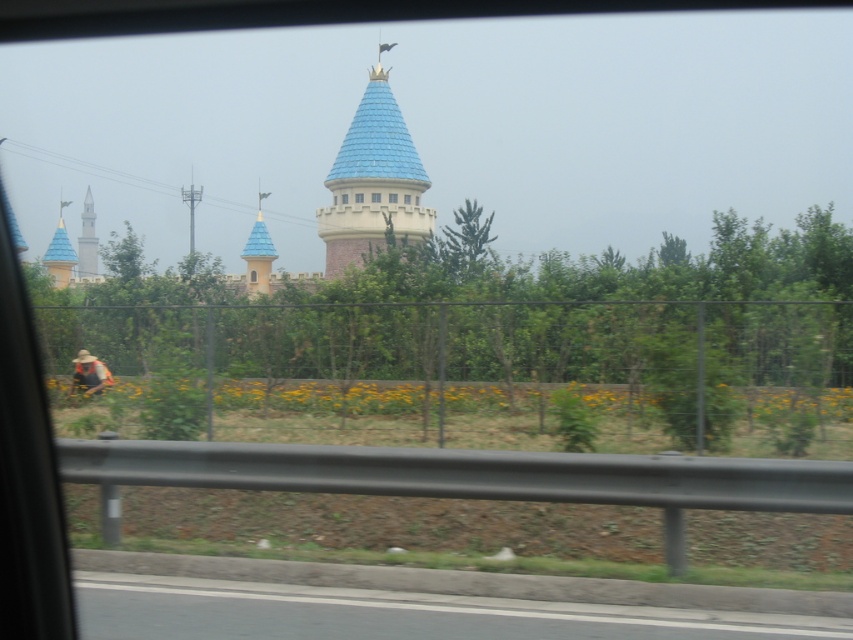
Is gray asphalt road at lower center wider than blue matte spire at center?

Indeed, gray asphalt road at lower center has a greater width compared to blue matte spire at center.

Who is more distant from viewer, (531, 602) or (253, 289)?

The point (253, 289) is more distant.

Who is more distant from viewer, (x=231, y=595) or (x=271, y=248)?

The point (x=271, y=248) is more distant.

Image resolution: width=853 pixels, height=640 pixels. In order to click on gray asphalt road at lower center in this screenshot , I will do `click(393, 614)`.

Is blue tiled tower at center further to the viewer compared to blue glossy spire at left?

No, it is in front of blue glossy spire at left.

Is blue tiled tower at center in front of blue glossy spire at left?

Yes, blue tiled tower at center is closer to the viewer.

The width and height of the screenshot is (853, 640). What do you see at coordinates (373, 180) in the screenshot?
I see `blue tiled tower at center` at bounding box center [373, 180].

Where is `blue tiled tower at center`? The width and height of the screenshot is (853, 640). blue tiled tower at center is located at coordinates (373, 180).

Consider the image. Does gray asphalt road at lower center come in front of white concrete tower at left?

Yes, gray asphalt road at lower center is in front of white concrete tower at left.

Who is shorter, gray asphalt road at lower center or white concrete tower at left?

gray asphalt road at lower center

Does point (480, 596) come behind point (90, 224)?

No, it is in front of (90, 224).

You are a GUI agent. You are given a task and a screenshot of the screen. Output one action in this format:
    pyautogui.click(x=<x>, y=<y>)
    Task: Click on the gray asphalt road at lower center
    The width and height of the screenshot is (853, 640).
    Given the screenshot: What is the action you would take?
    pyautogui.click(x=393, y=614)